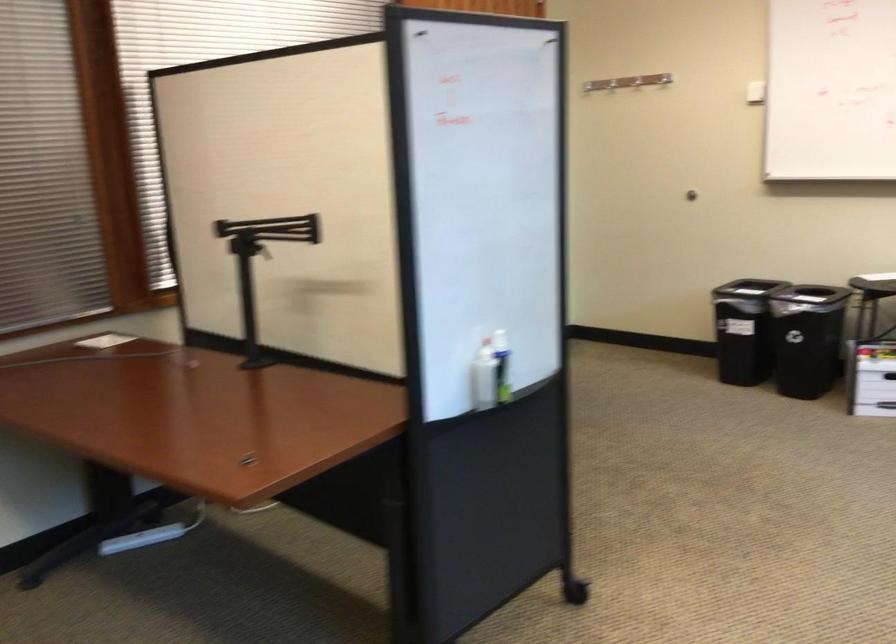
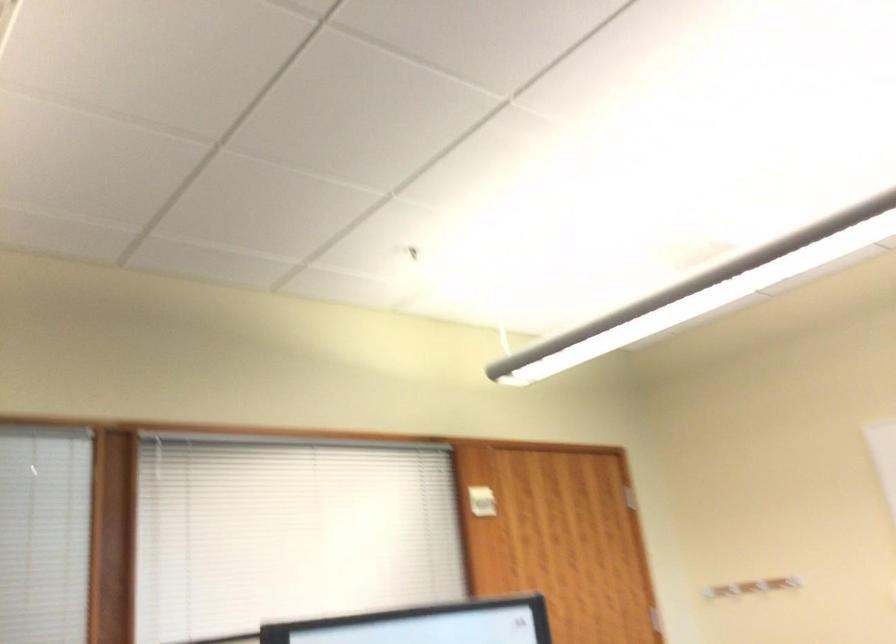
How did the camera likely rotate?

The rotation direction of the camera is left-up.